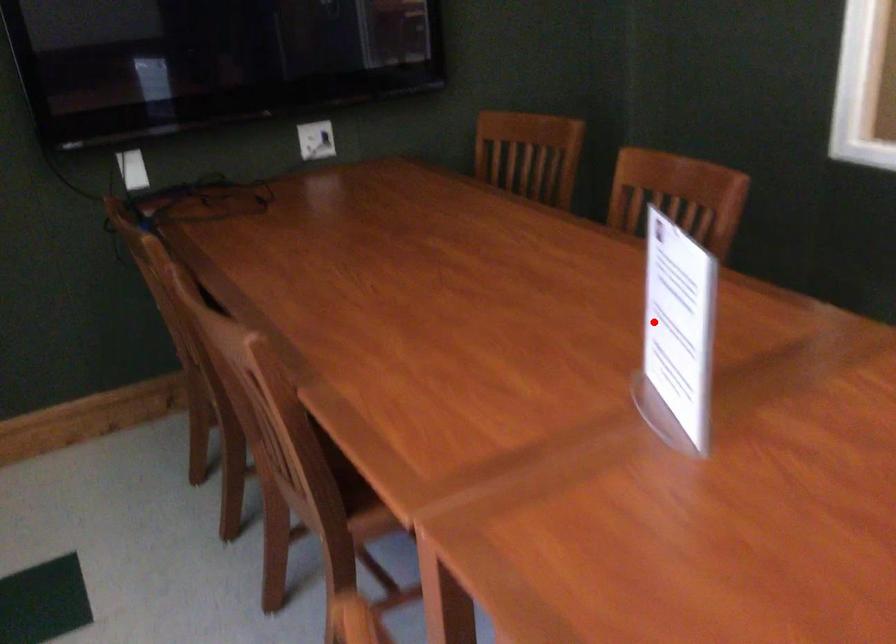
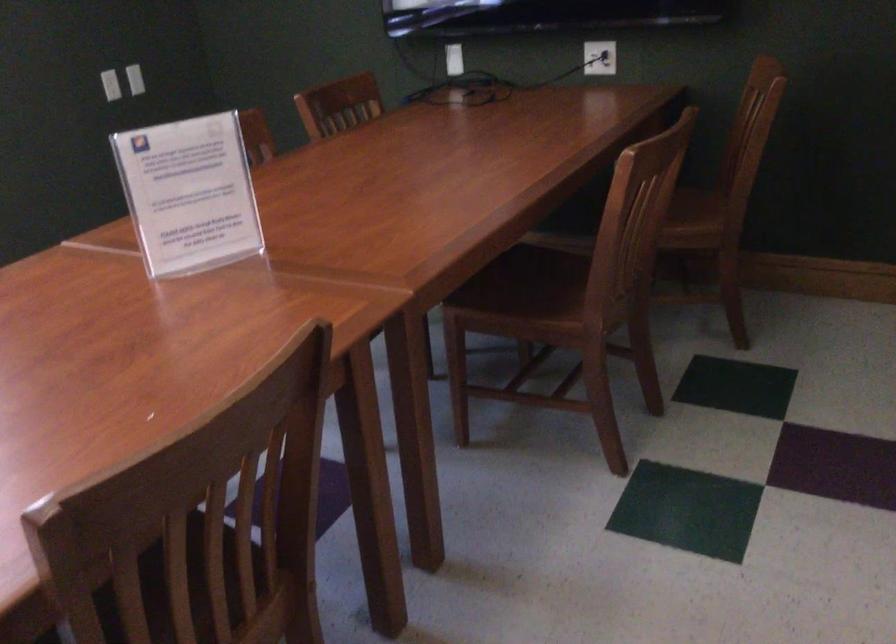
Find the pixel in the second image that matches the highlighted location in the first image.

(188, 194)